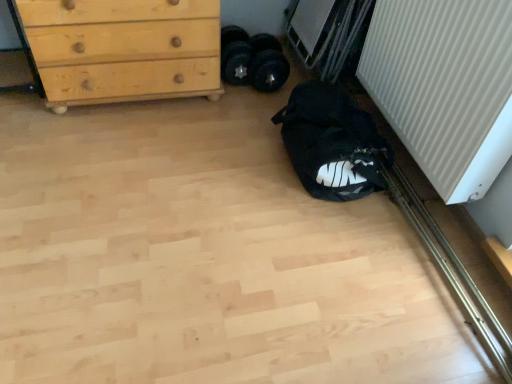
Question: Is white ribbed radiator at right oriented away from black fabric bag at lower right?

Choices:
 (A) no
 (B) yes

Answer: (A)

Question: Is the position of white ribbed radiator at right more distant than that of black fabric bag at lower right?

Choices:
 (A) yes
 (B) no

Answer: (B)

Question: Can you confirm if white ribbed radiator at right is taller than black fabric bag at lower right?

Choices:
 (A) yes
 (B) no

Answer: (A)

Question: Can you confirm if white ribbed radiator at right is thinner than black fabric bag at lower right?

Choices:
 (A) yes
 (B) no

Answer: (A)

Question: Is white ribbed radiator at right to the right of black fabric bag at lower right from the viewer's perspective?

Choices:
 (A) yes
 (B) no

Answer: (A)

Question: Is white ribbed radiator at right with black fabric bag at lower right?

Choices:
 (A) no
 (B) yes

Answer: (A)

Question: Is black fabric bag at lower right positioned in front of white ribbed radiator at right?

Choices:
 (A) no
 (B) yes

Answer: (A)

Question: Is the depth of black fabric bag at lower right greater than that of white ribbed radiator at right?

Choices:
 (A) yes
 (B) no

Answer: (A)

Question: Is black fabric bag at lower right facing away from white ribbed radiator at right?

Choices:
 (A) yes
 (B) no

Answer: (B)

Question: From the image's perspective, is black fabric bag at lower right under white ribbed radiator at right?

Choices:
 (A) yes
 (B) no

Answer: (A)

Question: Can you confirm if black fabric bag at lower right is smaller than white ribbed radiator at right?

Choices:
 (A) no
 (B) yes

Answer: (B)

Question: Does black fabric bag at lower right appear on the left side of white ribbed radiator at right?

Choices:
 (A) no
 (B) yes

Answer: (B)

Question: Can you confirm if black fabric bag at lower right is taller than light wood/texture chest of drawers at upper left?

Choices:
 (A) yes
 (B) no

Answer: (B)